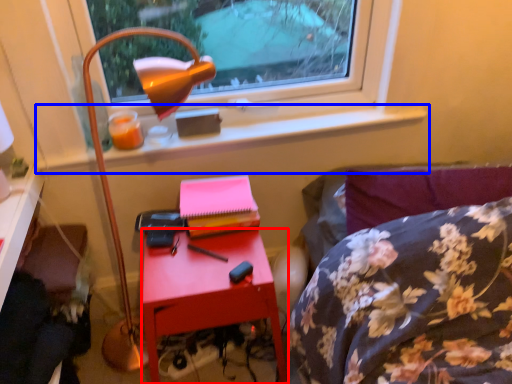
Question: Which object is further to the camera taking this photo, nightstand (highlighted by a red box) or window sill (highlighted by a blue box)?

Choices:
 (A) nightstand
 (B) window sill

Answer: (B)